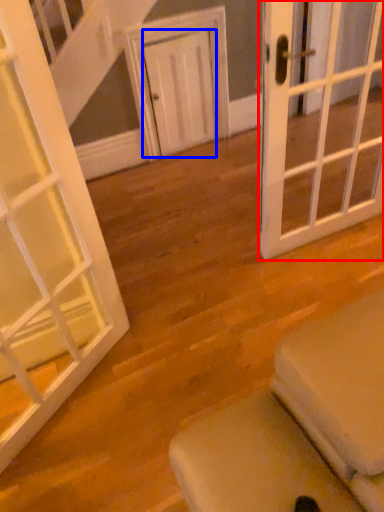
Question: Which object appears farthest to the camera in this image, door (highlighted by a red box) or door (highlighted by a blue box)?

Choices:
 (A) door
 (B) door

Answer: (B)